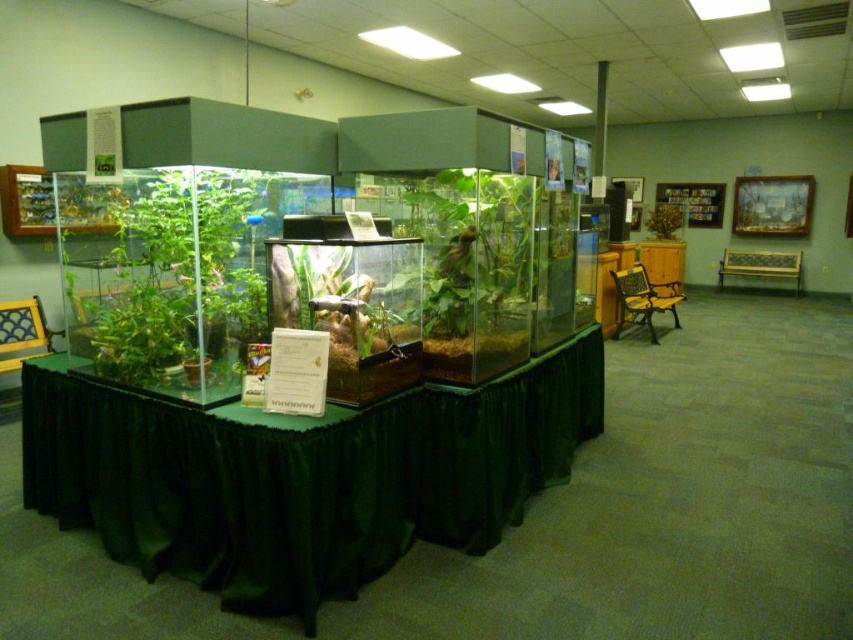
You are a delivery person who needs to place a box on the green fabric table at center. However, there is a green matte plant at center in the way. Can you place the box on the table without moving the plant?

The distance between the green fabric table at center and the green matte plant at center is 28.23 inches. Since the plant is on the table, you can place the box on the table as long as there is enough space around the plant. However, the exact placement depends on the box size and the plant location, but the distance suggests they are separate entities on the table.

What is located at the coordinates point (303, 477) in the image?

The green fabric table at center is located at point (303, 477).